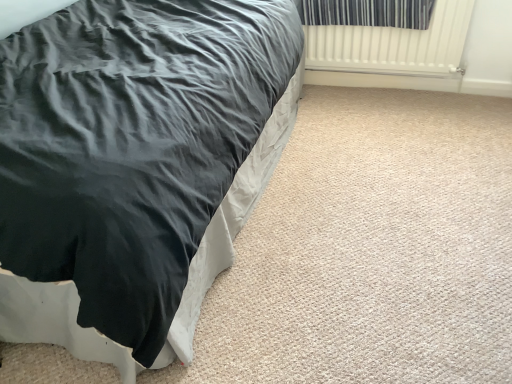
Question: Considering the relative sizes of striped fabric curtain at upper right and black satin bed at left in the image provided, is striped fabric curtain at upper right thinner than black satin bed at left?

Choices:
 (A) no
 (B) yes

Answer: (B)

Question: Would you say striped fabric curtain at upper right is outside black satin bed at left?

Choices:
 (A) no
 (B) yes

Answer: (B)

Question: Can you confirm if striped fabric curtain at upper right is positioned to the left of black satin bed at left?

Choices:
 (A) no
 (B) yes

Answer: (A)

Question: Is striped fabric curtain at upper right looking in the opposite direction of black satin bed at left?

Choices:
 (A) no
 (B) yes

Answer: (A)

Question: Does striped fabric curtain at upper right have a greater height compared to black satin bed at left?

Choices:
 (A) yes
 (B) no

Answer: (B)

Question: From the image's perspective, is black satin bed at left located above or below striped fabric curtain at upper right?

Choices:
 (A) below
 (B) above

Answer: (A)

Question: Considering the positions of black satin bed at left and striped fabric curtain at upper right in the image, is black satin bed at left bigger or smaller than striped fabric curtain at upper right?

Choices:
 (A) small
 (B) big

Answer: (B)

Question: From a real-world perspective, is black satin bed at left above or below striped fabric curtain at upper right?

Choices:
 (A) above
 (B) below

Answer: (B)

Question: Is black satin bed at left in front of or behind striped fabric curtain at upper right in the image?

Choices:
 (A) behind
 (B) front

Answer: (B)

Question: Does point (357, 56) appear closer or farther from the camera than point (335, 6)?

Choices:
 (A) farther
 (B) closer

Answer: (A)

Question: Is white ribbed radiator at upper right wider or thinner than striped fabric curtain at upper right?

Choices:
 (A) thin
 (B) wide

Answer: (A)

Question: From a real-world perspective, is white ribbed radiator at upper right positioned above or below striped fabric curtain at upper right?

Choices:
 (A) below
 (B) above

Answer: (A)

Question: In the image, is white ribbed radiator at upper right positioned in front of or behind striped fabric curtain at upper right?

Choices:
 (A) front
 (B) behind

Answer: (A)

Question: Looking at the image, does striped fabric curtain at upper right seem bigger or smaller compared to black satin bed at left?

Choices:
 (A) small
 (B) big

Answer: (A)

Question: Is striped fabric curtain at upper right taller or shorter than black satin bed at left?

Choices:
 (A) short
 (B) tall

Answer: (A)